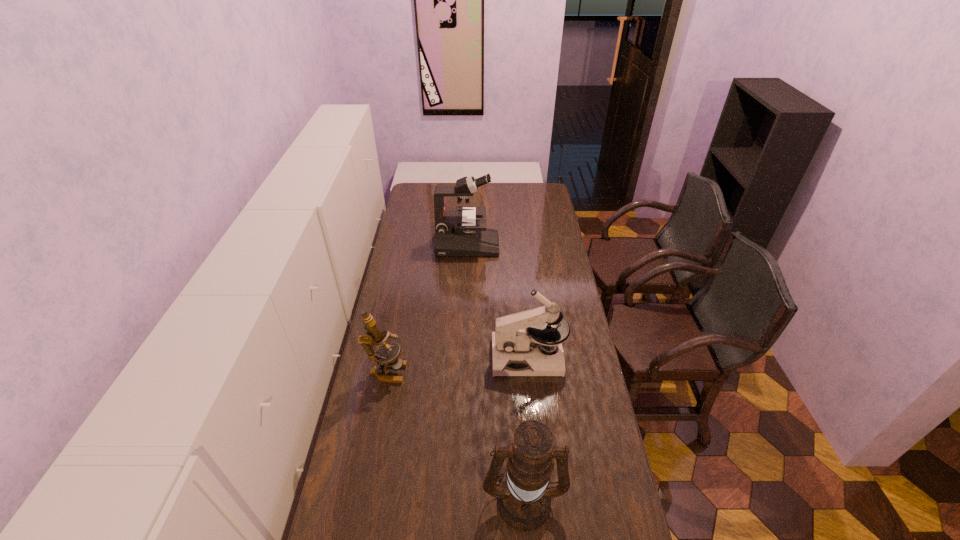
The height and width of the screenshot is (540, 960). In order to click on the farthest object in this screenshot , I will do (x=457, y=232).

This screenshot has height=540, width=960. Find the location of `oil lamp`. oil lamp is located at coordinates (524, 499).

This screenshot has height=540, width=960. In order to click on the leftmost microscope in this screenshot , I will do `click(374, 336)`.

At what (x,y) coordinates should I click in order to perform the action: click on vacant area located 0.200m through the eyepieces of the farthest object. Please return your answer as a coordinate pair (x, y). This screenshot has width=960, height=540. Looking at the image, I should click on (538, 245).

The image size is (960, 540). I want to click on vacant area situated 0.130m on the left of the oil lamp, so click(x=439, y=499).

This screenshot has width=960, height=540. Identify the location of free space located 0.230m on the right of the leftmost microscope. (468, 372).

Where is `object that is at the left edge`? This screenshot has height=540, width=960. object that is at the left edge is located at coordinates (374, 336).

Locate an element on the screen. The image size is (960, 540). object that is at the right edge is located at coordinates (518, 338).

Locate an element on the screen. This screenshot has width=960, height=540. free region at the far edge of the desktop is located at coordinates (501, 192).

At what (x,y) coordinates should I click in order to perform the action: click on vacant space at the left edge. Please return your answer as a coordinate pair (x, y). The image size is (960, 540). Looking at the image, I should click on (382, 528).